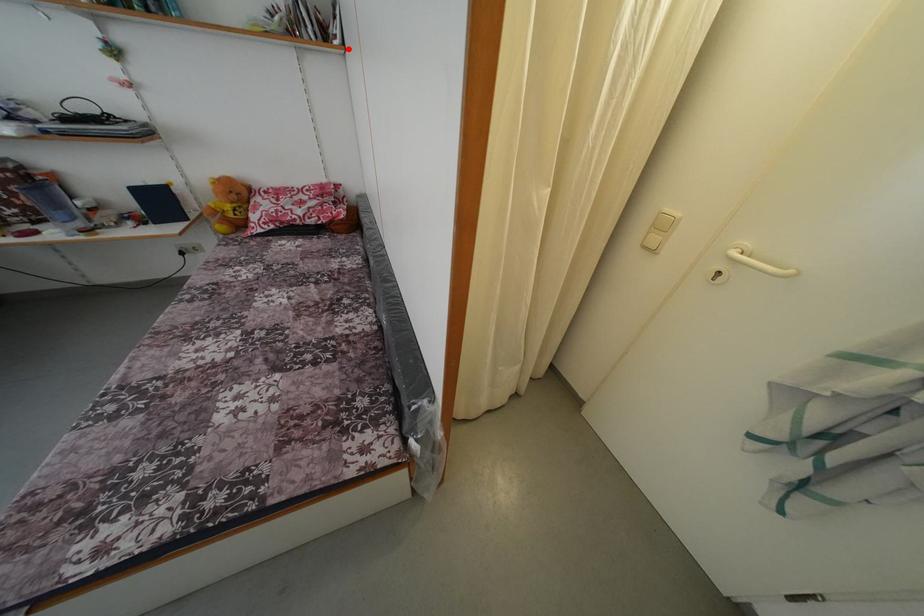
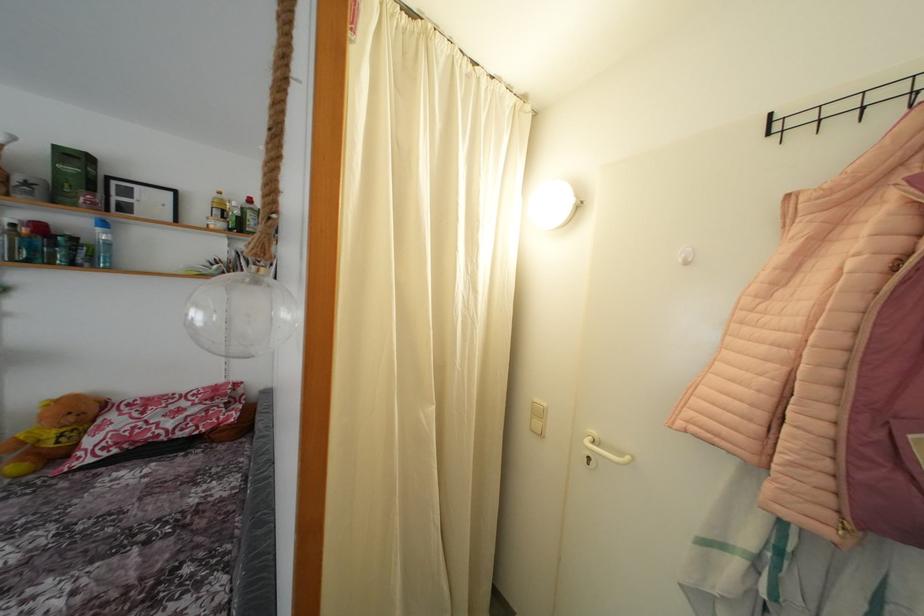
Where in the second image is the point corresponding to the highlighted location from the first image?

(281, 286)